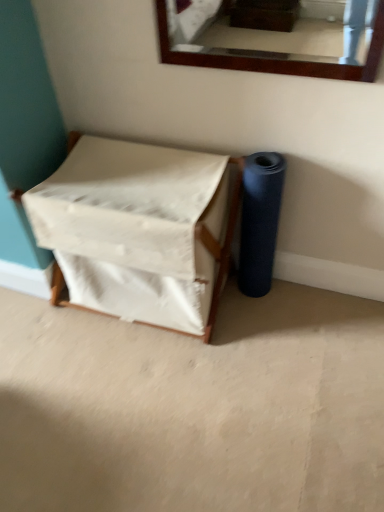
Question: Based on their positions, is white fabric-covered box at center-left located to the left or right of blue matte yoga mat at right?

Choices:
 (A) right
 (B) left

Answer: (B)

Question: In terms of size, does white fabric-covered box at center-left appear bigger or smaller than blue matte yoga mat at right?

Choices:
 (A) small
 (B) big

Answer: (B)

Question: Is point (54, 217) closer or farther from the camera than point (258, 258)?

Choices:
 (A) farther
 (B) closer

Answer: (B)

Question: From the image's perspective, is blue matte yoga mat at right located above or below white fabric-covered box at center-left?

Choices:
 (A) below
 (B) above

Answer: (B)

Question: Based on their positions, is blue matte yoga mat at right located to the left or right of white fabric-covered box at center-left?

Choices:
 (A) left
 (B) right

Answer: (B)

Question: Is blue matte yoga mat at right inside or outside of white fabric-covered box at center-left?

Choices:
 (A) inside
 (B) outside

Answer: (B)

Question: Is blue matte yoga mat at right wider or thinner than white fabric-covered box at center-left?

Choices:
 (A) thin
 (B) wide

Answer: (A)